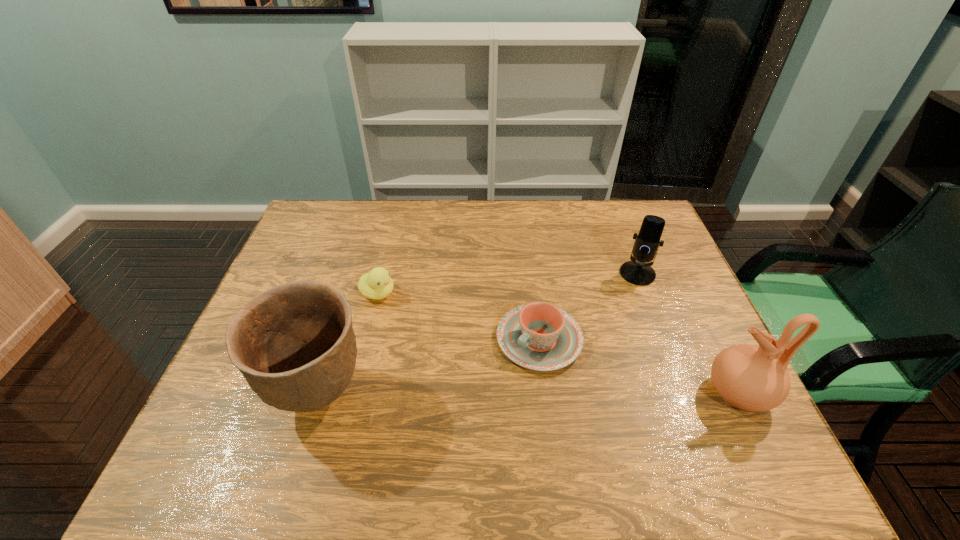
Locate an element on the screen. the left pottery is located at coordinates (294, 343).

Identify the location of the right pottery. (747, 377).

Find the location of `the second object from right to left`. the second object from right to left is located at coordinates (638, 271).

Identify the location of microphone. (638, 271).

Find the location of a particular element. This screenshot has width=960, height=540. duckling is located at coordinates (377, 284).

Locate an element on the screen. chinaware is located at coordinates (539, 336).

At what (x,y) coordinates should I click in order to perform the action: click on vacant space located 0.240m on the right of the left pottery. Please return your answer as a coordinate pair (x, y). The image size is (960, 540). Looking at the image, I should click on (474, 395).

Identify the location of vacant region located on the spout of the rightmost object. (562, 393).

This screenshot has height=540, width=960. What are the coordinates of `free space located 0.400m on the spout of the rightmost object` in the screenshot? It's located at (536, 393).

Locate an element on the screen. Image resolution: width=960 pixels, height=540 pixels. free space located 0.070m on the spout of the rightmost object is located at coordinates (676, 393).